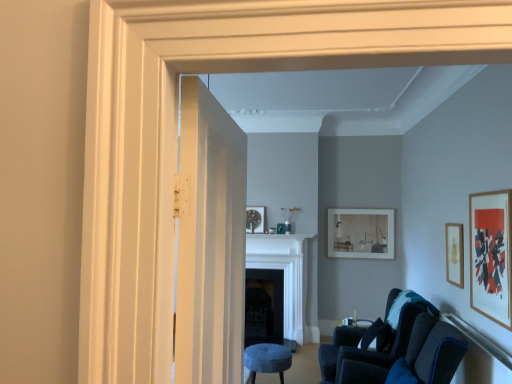
Question: Is black matte fireplace at center, placed as the second fireplace when sorted from front to back, positioned with its back to wooden picture frame at right, the 2th picture frame when ordered from front to back?

Choices:
 (A) no
 (B) yes

Answer: (A)

Question: From the image's perspective, is black matte fireplace at center, placed as the second fireplace when sorted from front to back, located beneath wooden picture frame at right, which is the second picture frame from back to front?

Choices:
 (A) no
 (B) yes

Answer: (B)

Question: Is black matte fireplace at center, placed as the second fireplace when sorted from front to back, located outside wooden picture frame at right, the 2th picture frame when ordered from front to back?

Choices:
 (A) yes
 (B) no

Answer: (A)

Question: Is black matte fireplace at center, placed as the second fireplace when sorted from front to back, to the left of wooden picture frame at right, the 2th picture frame when ordered from front to back, from the viewer's perspective?

Choices:
 (A) no
 (B) yes

Answer: (B)

Question: Is black matte fireplace at center, which ranks as the 1th fireplace in back-to-front order, positioned before wooden picture frame at right, the 2th picture frame when ordered from front to back?

Choices:
 (A) no
 (B) yes

Answer: (A)

Question: Is point (454, 261) positioned closer to the camera than point (280, 372)?

Choices:
 (A) farther
 (B) closer

Answer: (B)

Question: Looking at their shapes, would you say wooden picture frame at right, which is the second picture frame from back to front, is wider or thinner than velvet blue stool at lower center?

Choices:
 (A) wide
 (B) thin

Answer: (B)

Question: Is wooden picture frame at right, which is the second picture frame from back to front, situated inside velvet blue stool at lower center or outside?

Choices:
 (A) inside
 (B) outside

Answer: (B)

Question: From the image's perspective, relative to velvet blue stool at lower center, is wooden picture frame at right, which is the second picture frame from back to front, above or below?

Choices:
 (A) above
 (B) below

Answer: (A)

Question: Considering the relative positions of white marble fireplace at center, which is the second fireplace from back to front, and matte white picture frame at center-right, which appears as the 3th picture frame when viewed from the front, in the image provided, is white marble fireplace at center, which is the second fireplace from back to front, to the left or to the right of matte white picture frame at center-right, which appears as the 3th picture frame when viewed from the front,?

Choices:
 (A) left
 (B) right

Answer: (A)

Question: From the image's perspective, is white marble fireplace at center, positioned as the 1th fireplace in front-to-back order, located above or below matte white picture frame at center-right, marked as the first picture frame in a back-to-front arrangement?

Choices:
 (A) above
 (B) below

Answer: (B)

Question: Relative to matte white picture frame at center-right, which appears as the 3th picture frame when viewed from the front, is white marble fireplace at center, positioned as the 1th fireplace in front-to-back order, in front or behind?

Choices:
 (A) behind
 (B) front

Answer: (B)

Question: In terms of width, does white marble fireplace at center, positioned as the 1th fireplace in front-to-back order, look wider or thinner when compared to matte white picture frame at center-right, marked as the first picture frame in a back-to-front arrangement?

Choices:
 (A) wide
 (B) thin

Answer: (A)

Question: From their relative heights in the image, would you say velvet dark blue chair at lower right is taller or shorter than velvet blue stool at lower center?

Choices:
 (A) short
 (B) tall

Answer: (B)

Question: Looking at the image, does velvet dark blue chair at lower right seem bigger or smaller compared to velvet blue stool at lower center?

Choices:
 (A) small
 (B) big

Answer: (B)